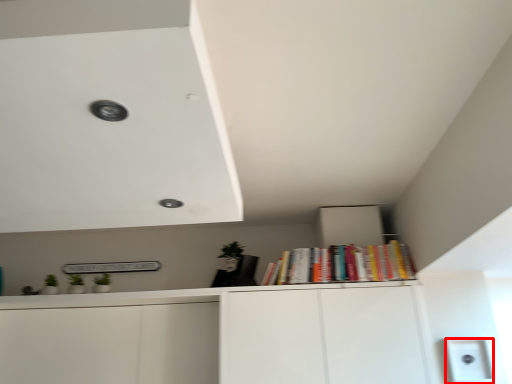
Question: Observing the image, what is the correct spatial positioning of light switch (annotated by the red box) in reference to book?

Choices:
 (A) right
 (B) left

Answer: (A)